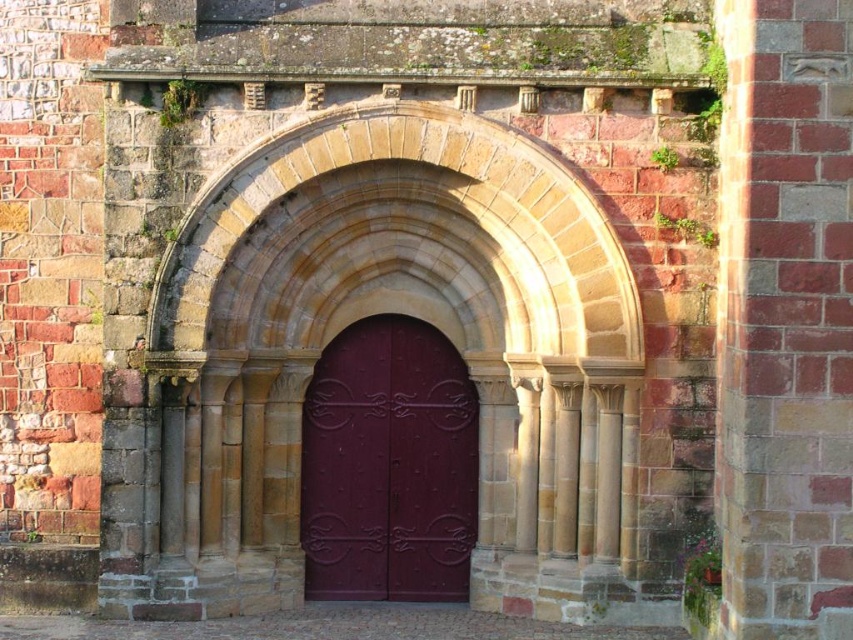
Question: Is stone archway at center closer to camera compared to glossy metal door at center?

Choices:
 (A) no
 (B) yes

Answer: (B)

Question: Which point is closer to the camera taking this photo?

Choices:
 (A) (257, 282)
 (B) (403, 480)

Answer: (A)

Question: Does stone archway at center have a lesser width compared to glossy metal door at center?

Choices:
 (A) yes
 (B) no

Answer: (A)

Question: Is stone archway at center thinner than glossy metal door at center?

Choices:
 (A) yes
 (B) no

Answer: (A)

Question: Which point is farther to the camera?

Choices:
 (A) (415, 230)
 (B) (334, 397)

Answer: (B)